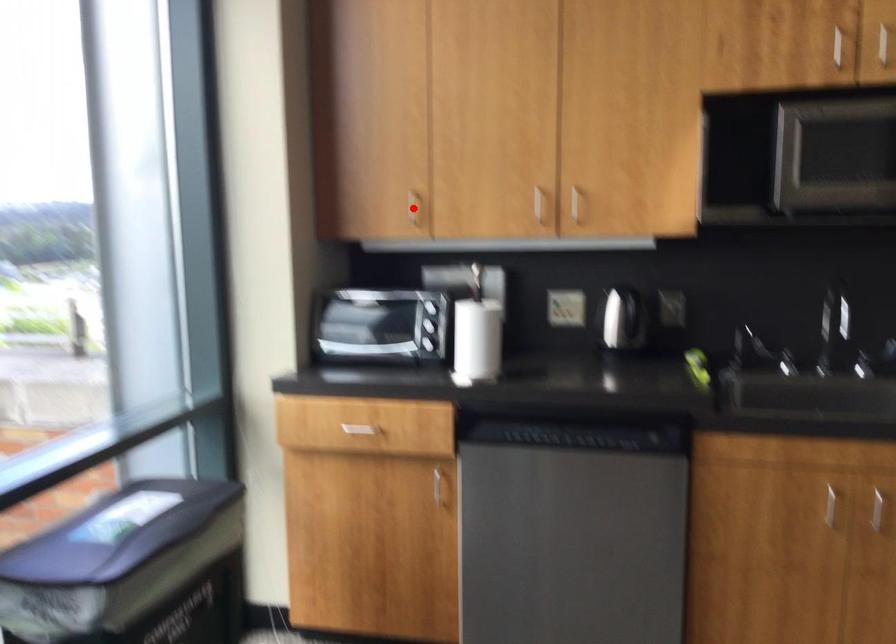
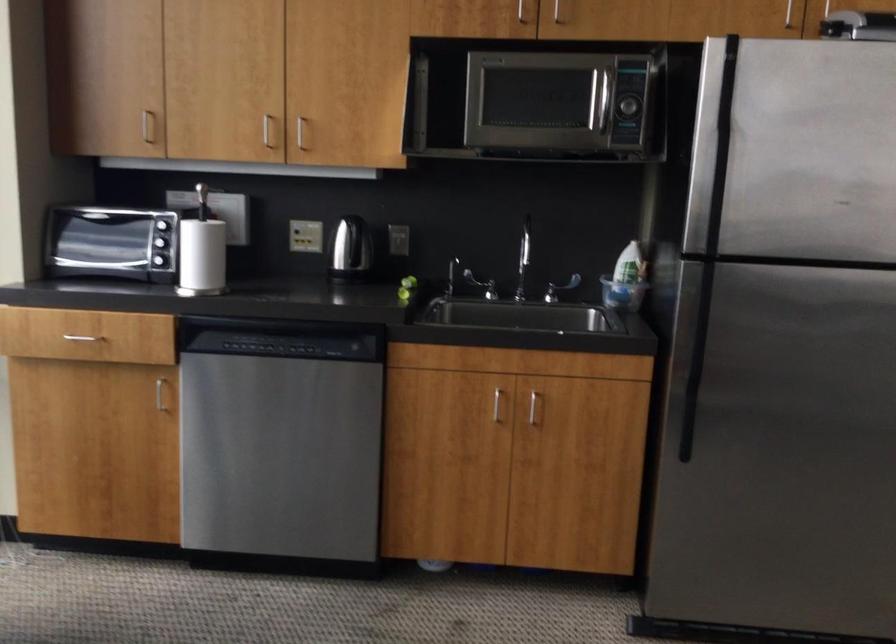
Find the pixel in the second image that matches the highlighted location in the first image.

(147, 126)